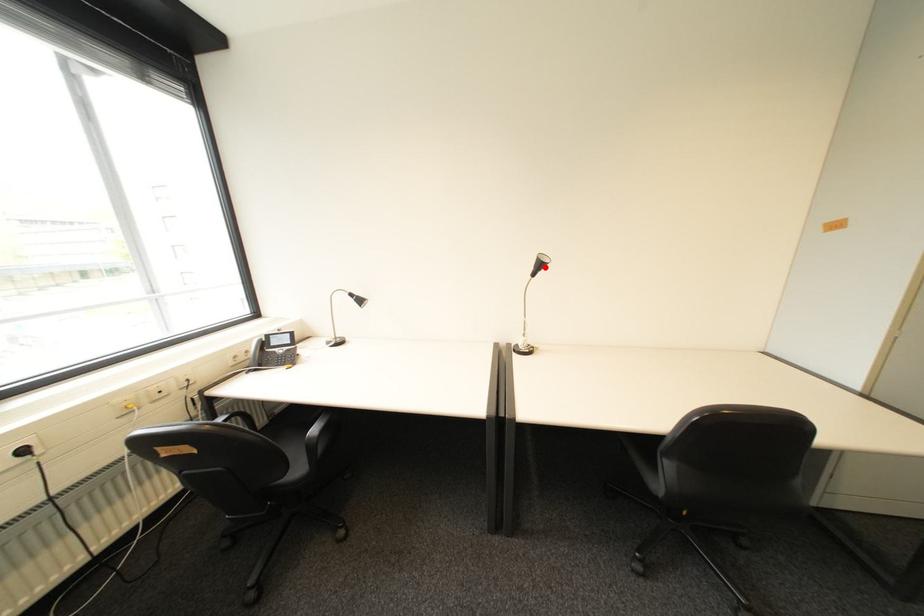
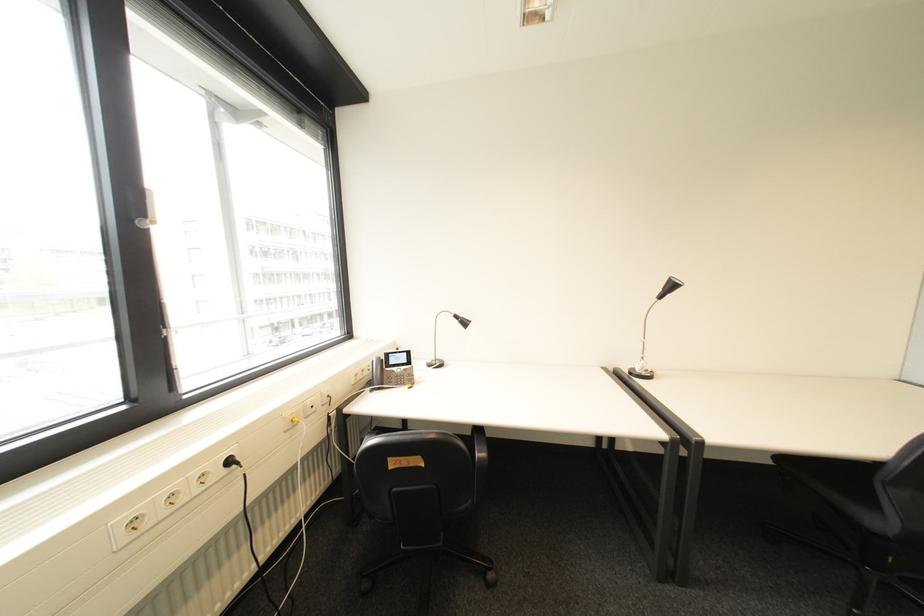
In the second image, find the point that corresponds to the highlighted location in the first image.

(673, 290)